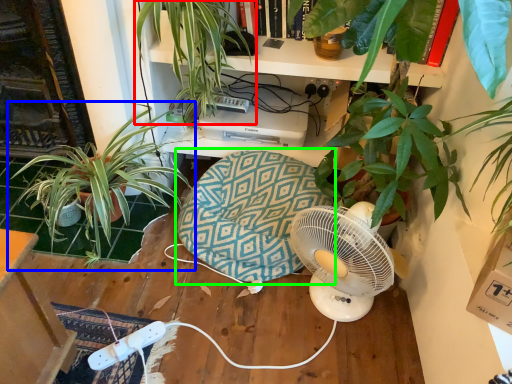
Question: Which object is the farthest from houseplant (highlighted by a red box)? Choose among these: houseplant (highlighted by a blue box) or swivel chair (highlighted by a green box).

Choices:
 (A) houseplant
 (B) swivel chair

Answer: (B)